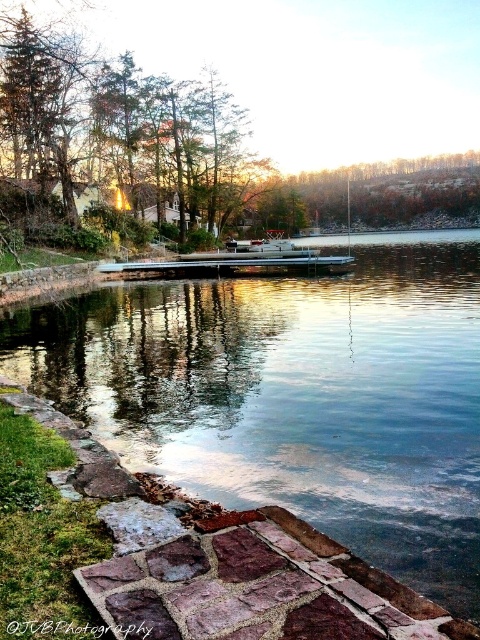
Describe the element at coordinates (226, 564) in the screenshot. I see `rustic stone path at lower center` at that location.

Is point (345, 589) less distant than point (297, 257)?

Yes, point (345, 589) is closer to viewer.

Image resolution: width=480 pixels, height=640 pixels. I want to click on rustic stone path at lower center, so click(226, 564).